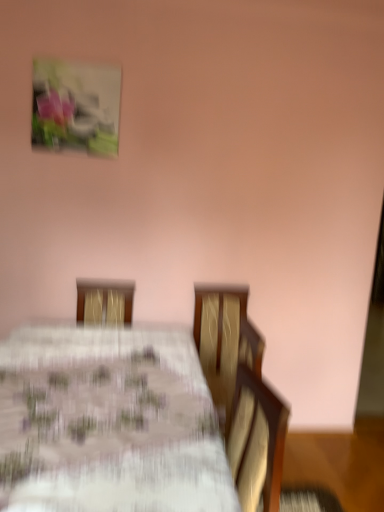
Question: From a real-world perspective, is matte plastic picture frame at upper left positioned over white floral tablecloth at center based on gravity?

Choices:
 (A) yes
 (B) no

Answer: (A)

Question: Considering the relative sizes of matte plastic picture frame at upper left and white floral tablecloth at center in the image provided, is matte plastic picture frame at upper left smaller than white floral tablecloth at center?

Choices:
 (A) yes
 (B) no

Answer: (A)

Question: Is matte plastic picture frame at upper left positioned in front of white floral tablecloth at center?

Choices:
 (A) yes
 (B) no

Answer: (B)

Question: Is the depth of matte plastic picture frame at upper left greater than that of white floral tablecloth at center?

Choices:
 (A) no
 (B) yes

Answer: (B)

Question: Can you confirm if matte plastic picture frame at upper left is wider than white floral tablecloth at center?

Choices:
 (A) yes
 (B) no

Answer: (B)

Question: Is matte plastic picture frame at upper left shorter than white floral tablecloth at center?

Choices:
 (A) yes
 (B) no

Answer: (A)

Question: Is white floral tablecloth at center not close to matte plastic picture frame at upper left?

Choices:
 (A) no
 (B) yes

Answer: (B)

Question: Is white floral tablecloth at center not inside matte plastic picture frame at upper left?

Choices:
 (A) yes
 (B) no

Answer: (A)

Question: Are white floral tablecloth at center and matte plastic picture frame at upper left making contact?

Choices:
 (A) yes
 (B) no

Answer: (B)

Question: From a real-world perspective, does white floral tablecloth at center stand above matte plastic picture frame at upper left?

Choices:
 (A) yes
 (B) no

Answer: (B)

Question: Can you confirm if white floral tablecloth at center is shorter than matte plastic picture frame at upper left?

Choices:
 (A) no
 (B) yes

Answer: (A)

Question: Is white floral tablecloth at center smaller than matte plastic picture frame at upper left?

Choices:
 (A) no
 (B) yes

Answer: (A)

Question: In the image, is matte plastic picture frame at upper left positioned in front of or behind white floral tablecloth at center?

Choices:
 (A) front
 (B) behind

Answer: (B)